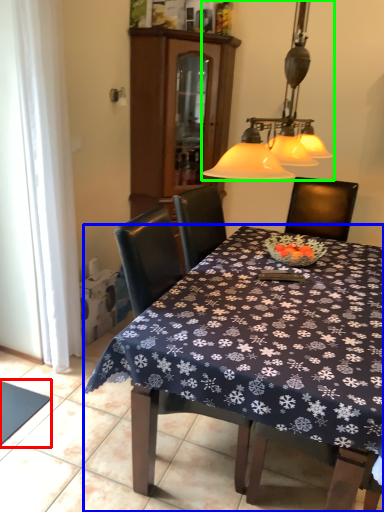
Question: Considering the real-world distances, which object is closest to tablecloth (highlighted by a red box)? kitchen & dining room table (highlighted by a blue box) or lamp (highlighted by a green box).

Choices:
 (A) kitchen & dining room table
 (B) lamp

Answer: (A)